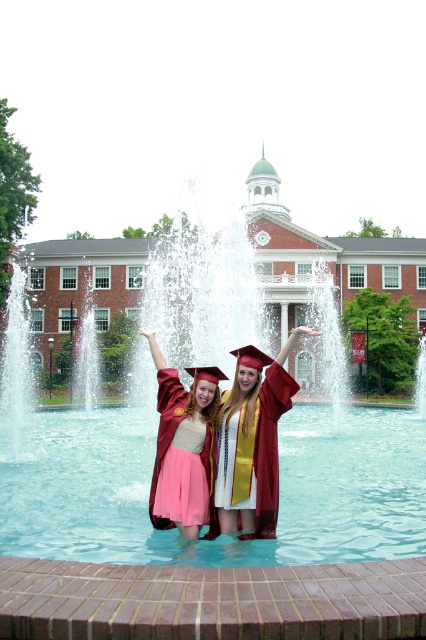
Who is shorter, clear glass water at center or maroon satin gown at center?

maroon satin gown at center is shorter.

Is clear glass water at center shorter than maroon satin gown at center?

Incorrect, clear glass water at center's height does not fall short of maroon satin gown at center's.

Find the location of a particular element. This screenshot has width=426, height=640. clear glass water at center is located at coordinates (336, 467).

Identify the location of clear glass water at center. (336, 467).

Can you confirm if clear glass water at center is positioned to the left of clear blue water at center?

Indeed, clear glass water at center is positioned on the left side of clear blue water at center.

Which is below, clear glass water at center or clear blue water at center?

Positioned lower is clear blue water at center.

Who is more distant from viewer, (224, 365) or (143, 449)?

The point (143, 449) is more distant.

Identify the location of clear glass water at center. (336, 467).

Who is more distant from viewer, (411, 477) or (247, 426)?

Point (411, 477)

Between clear blue water at center and maroon satin gown at center, which one is positioned lower?

clear blue water at center

Does point (69, 531) lie behind point (247, 524)?

Yes, it is behind point (247, 524).

Image resolution: width=426 pixels, height=640 pixels. Identify the location of clear blue water at center. (221, 536).